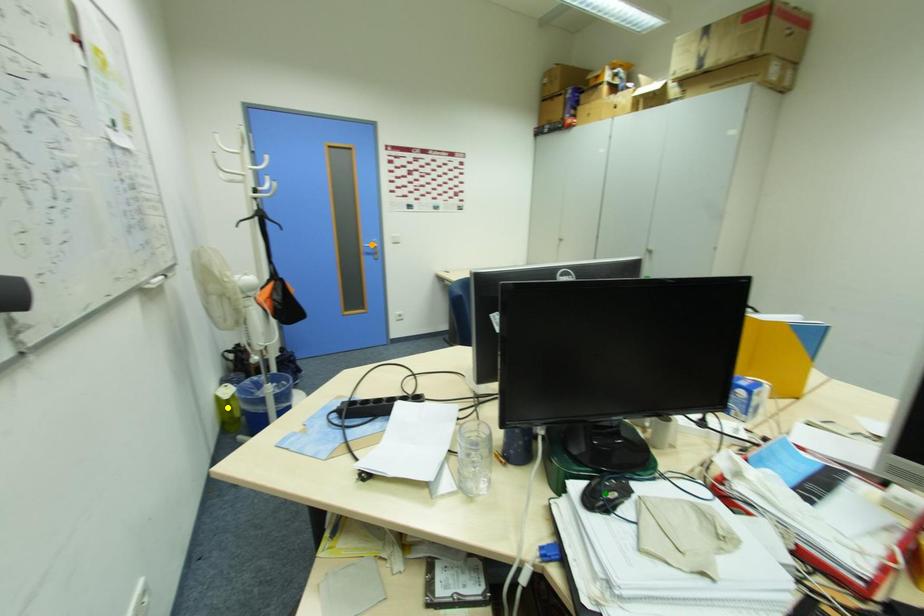
Order these from nearest to farthest:
- green point
- yellow point
- orange point

1. green point
2. yellow point
3. orange point